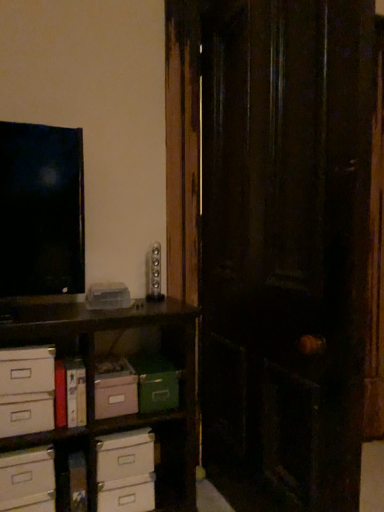
Question: Is green matte storage box at center, the second storage box when ordered from left to right, touching white cardboard drawer at lower left, the first drawer in the top-to-bottom sequence?

Choices:
 (A) yes
 (B) no

Answer: (B)

Question: Is green matte storage box at center, which appears as the first storage box when viewed from the right, oriented away from white cardboard drawer at lower left, the first drawer in the top-to-bottom sequence?

Choices:
 (A) yes
 (B) no

Answer: (B)

Question: Does green matte storage box at center, the second storage box when ordered from left to right, have a larger size compared to white cardboard drawer at lower left, the first drawer in the top-to-bottom sequence?

Choices:
 (A) no
 (B) yes

Answer: (B)

Question: Is green matte storage box at center, the second storage box when ordered from left to right, facing towards white cardboard drawer at lower left, the first drawer in the top-to-bottom sequence?

Choices:
 (A) yes
 (B) no

Answer: (B)

Question: Does green matte storage box at center, which appears as the first storage box when viewed from the right, have a lesser height compared to white cardboard drawer at lower left, which is the 3th drawer from bottom to top?

Choices:
 (A) no
 (B) yes

Answer: (A)

Question: From the image's perspective, is green matte storage box at center, which appears as the first storage box when viewed from the right, above white cardboard drawer at lower left, the first drawer in the top-to-bottom sequence?

Choices:
 (A) yes
 (B) no

Answer: (B)

Question: Is pastel pink cardboard storage box at center-left, the first storage box viewed from the left, not near dark wood door at center?

Choices:
 (A) yes
 (B) no

Answer: (B)

Question: Does pastel pink cardboard storage box at center-left, the first storage box viewed from the left, have a smaller size compared to dark wood door at center?

Choices:
 (A) no
 (B) yes

Answer: (B)

Question: From a real-world perspective, is pastel pink cardboard storage box at center-left, placed as the second storage box when sorted from right to left, over dark wood door at center?

Choices:
 (A) no
 (B) yes

Answer: (A)

Question: Is pastel pink cardboard storage box at center-left, placed as the second storage box when sorted from right to left, positioned with its back to dark wood door at center?

Choices:
 (A) yes
 (B) no

Answer: (B)

Question: Would you say pastel pink cardboard storage box at center-left, the first storage box viewed from the left, is outside dark wood door at center?

Choices:
 (A) yes
 (B) no

Answer: (A)

Question: Can dark wood door at center be found inside pastel pink cardboard storage box at center-left, the first storage box viewed from the left?

Choices:
 (A) yes
 (B) no

Answer: (B)

Question: From the image's perspective, is green matte storage box at center, which appears as the first storage box when viewed from the right, on top of white cardboard drawer at lower left, the first drawer from the bottom?

Choices:
 (A) yes
 (B) no

Answer: (A)